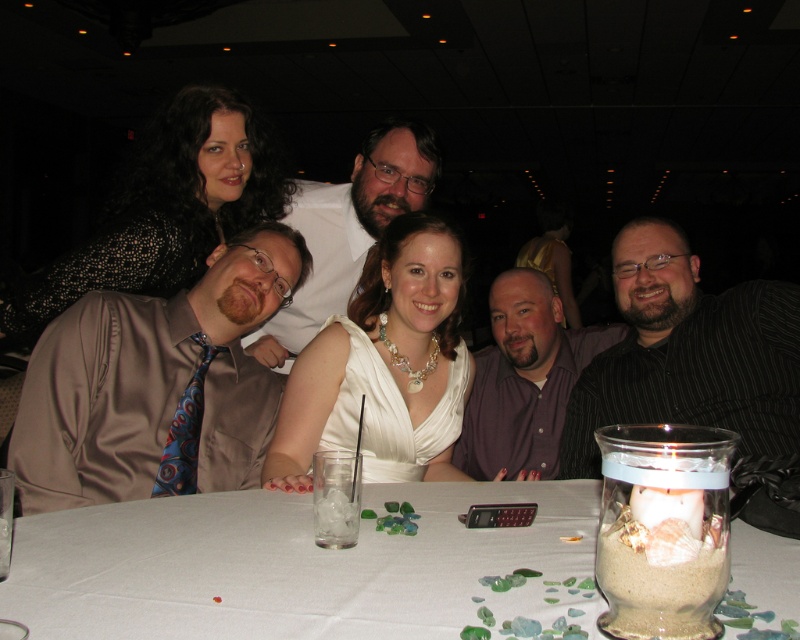
Measure the distance from satin brown shirt at left to black striped shirt at right.

1.03 meters

Who is higher up, satin brown shirt at left or black striped shirt at right?

black striped shirt at right is above.

In order to click on satin brown shirt at left in this screenshot , I will do `click(156, 385)`.

Where is `satin brown shirt at left`? satin brown shirt at left is located at coordinates (156, 385).

Can you confirm if satin brown shirt at left is smaller than matte white shirt at center?

Correct, satin brown shirt at left occupies less space than matte white shirt at center.

From the picture: Does satin brown shirt at left appear on the left side of matte white shirt at center?

Yes, satin brown shirt at left is to the left of matte white shirt at center.

Is point (178, 413) behind point (374, 218)?

No, (178, 413) is in front of (374, 218).

The height and width of the screenshot is (640, 800). Find the location of `satin brown shirt at left`. satin brown shirt at left is located at coordinates (156, 385).

Is sparkly black dress at upper left thinner than purple satin shirt at center?

No.

Which is more to the left, sparkly black dress at upper left or purple satin shirt at center?

Positioned to the left is sparkly black dress at upper left.

At what (x,y) coordinates should I click in order to perform the action: click on sparkly black dress at upper left. Please return your answer as a coordinate pair (x, y). Looking at the image, I should click on (166, 209).